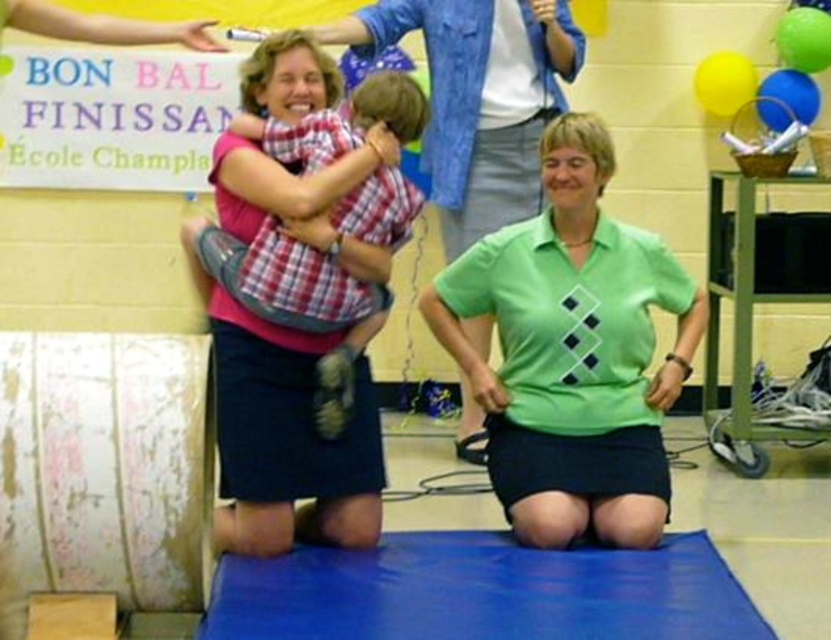
Between blue fabric yoga mat at center and plaid fabric shirt at upper left, which one has more height?

With more height is plaid fabric shirt at upper left.

From the picture: Can you confirm if blue fabric yoga mat at center is shorter than plaid fabric shirt at upper left?

Yes, blue fabric yoga mat at center is shorter than plaid fabric shirt at upper left.

Is point (384, 630) farther from camera compared to point (347, 228)?

No, it is in front of (347, 228).

Where is `blue fabric yoga mat at center`? The width and height of the screenshot is (831, 640). blue fabric yoga mat at center is located at coordinates (482, 592).

Does green argyle polo shirt at center come behind blue fabric yoga mat at center?

Yes, it is behind blue fabric yoga mat at center.

Can you confirm if green argyle polo shirt at center is positioned below blue fabric yoga mat at center?

No.

Between point (578, 214) and point (692, 596), which one is positioned in front?

Point (692, 596) is in front.

Where is `green argyle polo shirt at center`? green argyle polo shirt at center is located at coordinates (573, 353).

Is blue fabric yoga mat at center below green argyle sweater at center?

Yes, blue fabric yoga mat at center is below green argyle sweater at center.

This screenshot has width=831, height=640. Describe the element at coordinates (482, 592) in the screenshot. I see `blue fabric yoga mat at center` at that location.

Describe the element at coordinates (482, 592) in the screenshot. I see `blue fabric yoga mat at center` at that location.

At what (x,y) coordinates should I click in order to perform the action: click on blue fabric yoga mat at center. Please return your answer as a coordinate pair (x, y). The image size is (831, 640). Looking at the image, I should click on (482, 592).